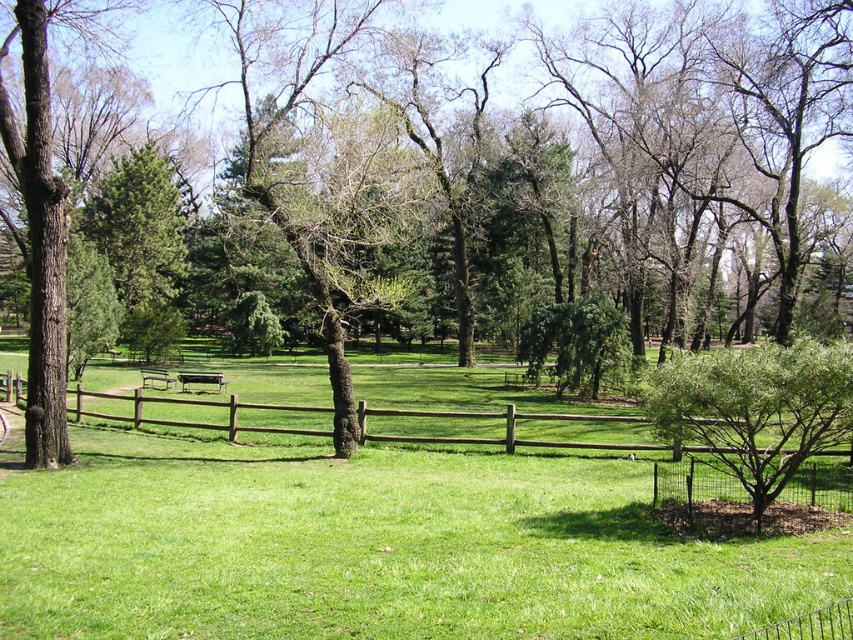
You are standing in the park and want to take a photo of the brown wood tree at center. If your camera has a maximum focus range of 15 meters, will you be able to capture the tree clearly?

The brown wood tree at center is 16.03 meters away from the viewer, which exceeds the camera maximum focus range of 15 meters. Therefore, the camera cannot capture the tree clearly.

You are standing in the park and want to walk towards the green leafy bush at lower right. Is the brown wooden fence at center blocking your path?

The brown wooden fence at center is positioned over green leafy bush at lower right, so it is blocking the path to the bush.